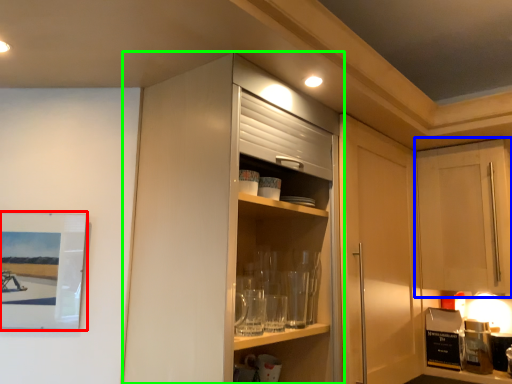
Question: Estimate the real-world distances between objects in this image. Which object is farther from picture frame (highlighted by a red box), cabinetry (highlighted by a blue box) or cabinetry (highlighted by a green box)?

Choices:
 (A) cabinetry
 (B) cabinetry

Answer: (A)